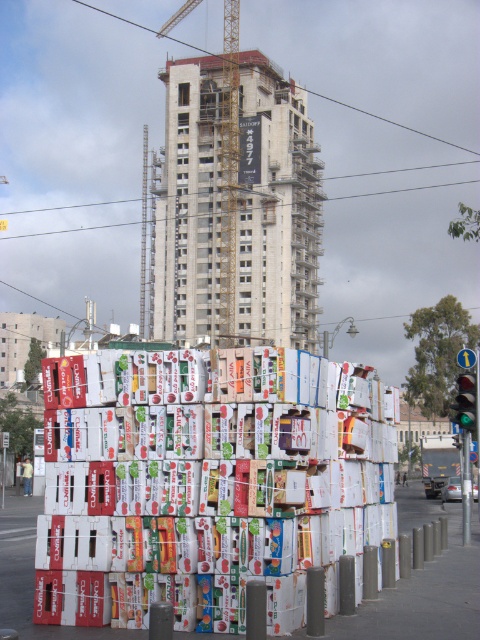
Question: Which point is closer to the camera?

Choices:
 (A) green traffic light at right
 (B) green glass traffic light at center right

Answer: (A)

Question: Based on their relative distances, which object is nearer to the yellow metal crane at upper center?

Choices:
 (A) green traffic light at right
 (B) green glass traffic light at center right

Answer: (B)

Question: Is yellow metal crane at upper center bigger than green glass traffic light at center right?

Choices:
 (A) yes
 (B) no

Answer: (A)

Question: Is green glass traffic light at center right above green traffic light at right?

Choices:
 (A) yes
 (B) no

Answer: (B)

Question: Is yellow metal crane at upper center further to the viewer compared to green glass traffic light at center right?

Choices:
 (A) no
 (B) yes

Answer: (B)

Question: Which object is the farthest from the yellow metal crane at upper center?

Choices:
 (A) green glass traffic light at center right
 (B) green traffic light at right

Answer: (B)